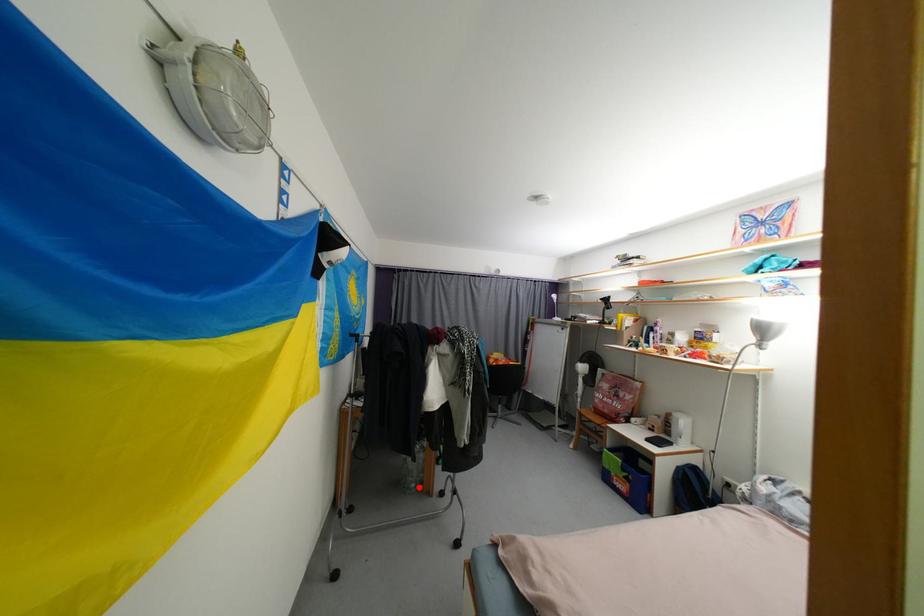
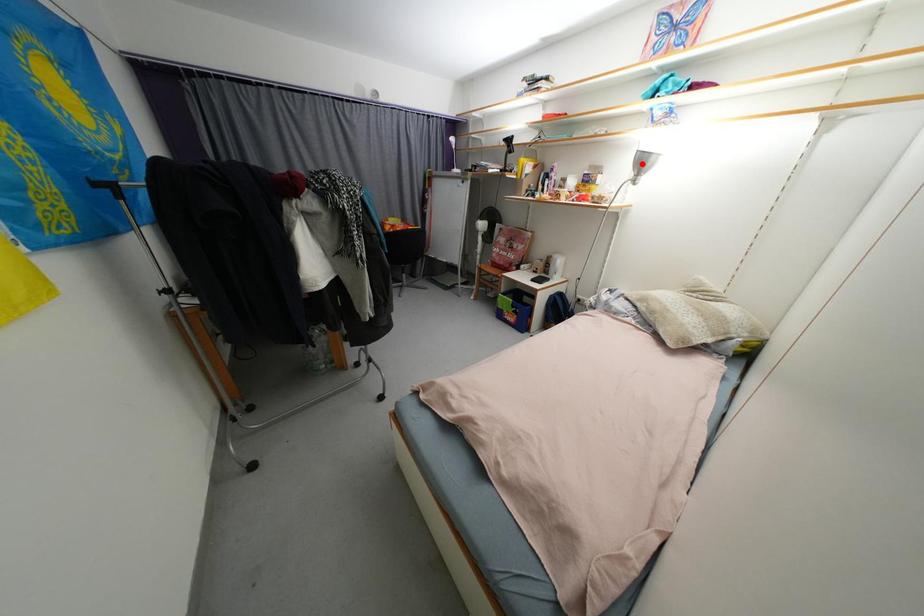
I am providing you with two images of the same scene from different viewpoints. A red point is marked on the first image and another point is marked on the second image. Do the highlighted points in image1 and image2 indicate the same real-world spot?

No